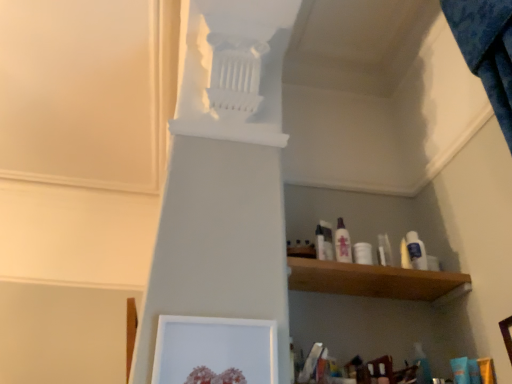
In order to face white glossy lotion at upper center, the second toiletry when ordered from left to right, should I rotate leftwards or rightwards?

You should look right and rotate roughly 11.388 degrees.

Locate an element on the screen. The width and height of the screenshot is (512, 384). white glossy lotion at upper center, placed as the second toiletry when sorted from right to left is located at coordinates (342, 243).

Image resolution: width=512 pixels, height=384 pixels. Describe the element at coordinates (215, 350) in the screenshot. I see `white matte picture frame at lower center` at that location.

Identify the location of white plastic bottle at upper right, which is the 3th toiletry in left-to-right order. Image resolution: width=512 pixels, height=384 pixels. (416, 251).

Choose the correct answer: Is white plastic bottle at center, which is the 3th toiletry from right to left, inside white plastic bottle at upper right, which is the 1th toiletry from right to left, or outside it?

white plastic bottle at center, which is the 3th toiletry from right to left, is outside white plastic bottle at upper right, which is the 1th toiletry from right to left.

In the image, is white plastic bottle at center, placed as the first toiletry when sorted from left to right, positioned in front of or behind white plastic bottle at upper right, which is the 3th toiletry in left-to-right order?

In the image, white plastic bottle at center, placed as the first toiletry when sorted from left to right, appears in front of white plastic bottle at upper right, which is the 3th toiletry in left-to-right order.

Can you confirm if white plastic bottle at center, placed as the first toiletry when sorted from left to right, is bigger than white plastic bottle at upper right, which is the 3th toiletry in left-to-right order?

Incorrect, white plastic bottle at center, placed as the first toiletry when sorted from left to right, is not larger than white plastic bottle at upper right, which is the 3th toiletry in left-to-right order.

Which point is more distant from viewer, [322,246] or [416,234]?

The point [416,234] is more distant.

Do you think white plastic bottle at center, placed as the first toiletry when sorted from left to right, is within white matte picture frame at lower center, or outside of it?

white plastic bottle at center, placed as the first toiletry when sorted from left to right, is not enclosed by white matte picture frame at lower center.

Considering the positions of point (316, 235) and point (273, 367), is point (316, 235) closer or farther from the camera than point (273, 367)?

Clearly, point (316, 235) is more distant from the camera than point (273, 367).

From the image's perspective, relative to white matte picture frame at lower center, is white plastic bottle at center, which is the 3th toiletry from right to left, above or below?

Based on their image positions, white plastic bottle at center, which is the 3th toiletry from right to left, is located above white matte picture frame at lower center.

Is white plastic bottle at center, placed as the first toiletry when sorted from left to right, to the left of white matte picture frame at lower center from the viewer's perspective?

No, white plastic bottle at center, placed as the first toiletry when sorted from left to right, is not to the left of white matte picture frame at lower center.

Visually, is white glossy lotion at upper center, the second toiletry when ordered from left to right, positioned to the left or to the right of white plastic bottle at upper right, which is the 1th toiletry from right to left?

white glossy lotion at upper center, the second toiletry when ordered from left to right, is to the left of white plastic bottle at upper right, which is the 1th toiletry from right to left.

Considering the sizes of objects white glossy lotion at upper center, the second toiletry when ordered from left to right, and white plastic bottle at upper right, which is the 3th toiletry in left-to-right order, in the image provided, who is taller, white glossy lotion at upper center, the second toiletry when ordered from left to right, or white plastic bottle at upper right, which is the 3th toiletry in left-to-right order,?

white glossy lotion at upper center, the second toiletry when ordered from left to right.

Is point (335, 242) in front of point (412, 244)?

Yes.

Considering the sizes of objects white glossy lotion at upper center, the second toiletry when ordered from left to right, and white plastic bottle at upper right, which is the 3th toiletry in left-to-right order, in the image provided, who is thinner, white glossy lotion at upper center, the second toiletry when ordered from left to right, or white plastic bottle at upper right, which is the 3th toiletry in left-to-right order,?

With smaller width is white plastic bottle at upper right, which is the 3th toiletry in left-to-right order.

Does white matte picture frame at lower center lie behind white plastic bottle at upper right, which is the 3th toiletry in left-to-right order?

No, it is in front of white plastic bottle at upper right, which is the 3th toiletry in left-to-right order.

Is white matte picture frame at lower center inside or outside of white plastic bottle at upper right, which is the 3th toiletry in left-to-right order?

white matte picture frame at lower center is not inside white plastic bottle at upper right, which is the 3th toiletry in left-to-right order, it's outside.

Does white matte picture frame at lower center have a larger size compared to white plastic bottle at upper right, which is the 1th toiletry from right to left?

Yes.

Does white plastic bottle at upper right, which is the 1th toiletry from right to left, have a greater width compared to white plastic bottle at center, placed as the first toiletry when sorted from left to right?

No, white plastic bottle at upper right, which is the 1th toiletry from right to left, is not wider than white plastic bottle at center, placed as the first toiletry when sorted from left to right.

Can white plastic bottle at center, placed as the first toiletry when sorted from left to right, be found inside white plastic bottle at upper right, which is the 1th toiletry from right to left?

No, white plastic bottle at center, placed as the first toiletry when sorted from left to right, is not inside white plastic bottle at upper right, which is the 1th toiletry from right to left.

From the image's perspective, who appears lower, white plastic bottle at upper right, which is the 3th toiletry in left-to-right order, or white plastic bottle at center, which is the 3th toiletry from right to left?

From the image's view, white plastic bottle at upper right, which is the 3th toiletry in left-to-right order, is below.

Considering the positions of point (415, 237) and point (324, 253), is point (415, 237) closer or farther from the camera than point (324, 253)?

Point (415, 237) appears to be farther away from the viewer than point (324, 253).

Is white plastic bottle at upper right, which is the 3th toiletry in left-to-right order, positioned far away from white matte picture frame at lower center?

No, there isn't a large distance between white plastic bottle at upper right, which is the 3th toiletry in left-to-right order, and white matte picture frame at lower center.

Considering the relative sizes of white plastic bottle at upper right, which is the 3th toiletry in left-to-right order, and white matte picture frame at lower center in the image provided, is white plastic bottle at upper right, which is the 3th toiletry in left-to-right order, wider than white matte picture frame at lower center?

Incorrect, the width of white plastic bottle at upper right, which is the 3th toiletry in left-to-right order, does not surpass that of white matte picture frame at lower center.

Is white plastic bottle at upper right, which is the 1th toiletry from right to left, not within white matte picture frame at lower center?

Yes, white plastic bottle at upper right, which is the 1th toiletry from right to left, is outside of white matte picture frame at lower center.

Between white glossy lotion at upper center, the second toiletry when ordered from left to right, and white plastic bottle at center, placed as the first toiletry when sorted from left to right, which one has larger width?

Wider between the two is white glossy lotion at upper center, the second toiletry when ordered from left to right.

Is white glossy lotion at upper center, placed as the second toiletry when sorted from right to left, placed right next to white plastic bottle at center, placed as the first toiletry when sorted from left to right?

Yes, white glossy lotion at upper center, placed as the second toiletry when sorted from right to left, and white plastic bottle at center, placed as the first toiletry when sorted from left to right, clearly make contact.

From a real-world perspective, is white glossy lotion at upper center, placed as the second toiletry when sorted from right to left, physically below white plastic bottle at center, which is the 3th toiletry from right to left?

Incorrect, from a real-world perspective, white glossy lotion at upper center, placed as the second toiletry when sorted from right to left, is higher than white plastic bottle at center, which is the 3th toiletry from right to left.

Based on their sizes in the image, would you say white glossy lotion at upper center, the second toiletry when ordered from left to right, is bigger or smaller than white plastic bottle at center, which is the 3th toiletry from right to left?

white glossy lotion at upper center, the second toiletry when ordered from left to right, is bigger than white plastic bottle at center, which is the 3th toiletry from right to left.

The image size is (512, 384). In order to click on toiletry that is the 2nd object to the left of the white plastic bottle at upper right, which is the 3th toiletry in left-to-right order, starting at the anchor in this screenshot , I will do `click(320, 243)`.

From a real-world perspective, which toiletry is the 1st one above the white matte picture frame at lower center? Please provide its 2D coordinates.

[(320, 243)]

Looking at the image, which one is located closer to white glossy lotion at upper center, placed as the second toiletry when sorted from right to left, white plastic bottle at center, placed as the first toiletry when sorted from left to right, or white matte picture frame at lower center?

Among the two, white plastic bottle at center, placed as the first toiletry when sorted from left to right, is located nearer to white glossy lotion at upper center, placed as the second toiletry when sorted from right to left.

Based on their spatial positions, is white glossy lotion at upper center, the second toiletry when ordered from left to right, or white plastic bottle at center, which is the 3th toiletry from right to left, further from white matte picture frame at lower center?

Based on the image, white glossy lotion at upper center, the second toiletry when ordered from left to right, appears to be further to white matte picture frame at lower center.

When comparing their distances from white plastic bottle at center, placed as the first toiletry when sorted from left to right, does white plastic bottle at upper right, which is the 1th toiletry from right to left, or white matte picture frame at lower center seem closer?

The object closer to white plastic bottle at center, placed as the first toiletry when sorted from left to right, is white plastic bottle at upper right, which is the 1th toiletry from right to left.

When comparing their distances from white plastic bottle at center, which is the 3th toiletry from right to left, does white matte picture frame at lower center or white plastic bottle at upper right, which is the 3th toiletry in left-to-right order, seem further?

white matte picture frame at lower center is further to white plastic bottle at center, which is the 3th toiletry from right to left.

Which object lies nearer to the anchor point white glossy lotion at upper center, the second toiletry when ordered from left to right, white matte picture frame at lower center or white plastic bottle at upper right, which is the 3th toiletry in left-to-right order?

The object closer to white glossy lotion at upper center, the second toiletry when ordered from left to right, is white plastic bottle at upper right, which is the 3th toiletry in left-to-right order.

From the image, which object appears to be nearer to white plastic bottle at center, which is the 3th toiletry from right to left, white plastic bottle at upper right, which is the 3th toiletry in left-to-right order, or white glossy lotion at upper center, placed as the second toiletry when sorted from right to left?

The object closer to white plastic bottle at center, which is the 3th toiletry from right to left, is white glossy lotion at upper center, placed as the second toiletry when sorted from right to left.

Estimate the real-world distances between objects in this image. Which object is closer to white plastic bottle at upper right, which is the 1th toiletry from right to left, white matte picture frame at lower center or white glossy lotion at upper center, placed as the second toiletry when sorted from right to left?

Based on the image, white glossy lotion at upper center, placed as the second toiletry when sorted from right to left, appears to be nearer to white plastic bottle at upper right, which is the 1th toiletry from right to left.

Based on the photo, estimate the real-world distances between objects in this image. Which object is further from white glossy lotion at upper center, placed as the second toiletry when sorted from right to left, white plastic bottle at upper right, which is the 1th toiletry from right to left, or white matte picture frame at lower center?

The object further to white glossy lotion at upper center, placed as the second toiletry when sorted from right to left, is white matte picture frame at lower center.

This screenshot has width=512, height=384. I want to click on toiletry situated between white plastic bottle at center, which is the 3th toiletry from right to left, and white plastic bottle at upper right, which is the 1th toiletry from right to left, from left to right, so click(342, 243).

In order to click on toiletry between white matte picture frame at lower center and white glossy lotion at upper center, the second toiletry when ordered from left to right, in the front-back direction in this screenshot , I will do `click(320, 243)`.